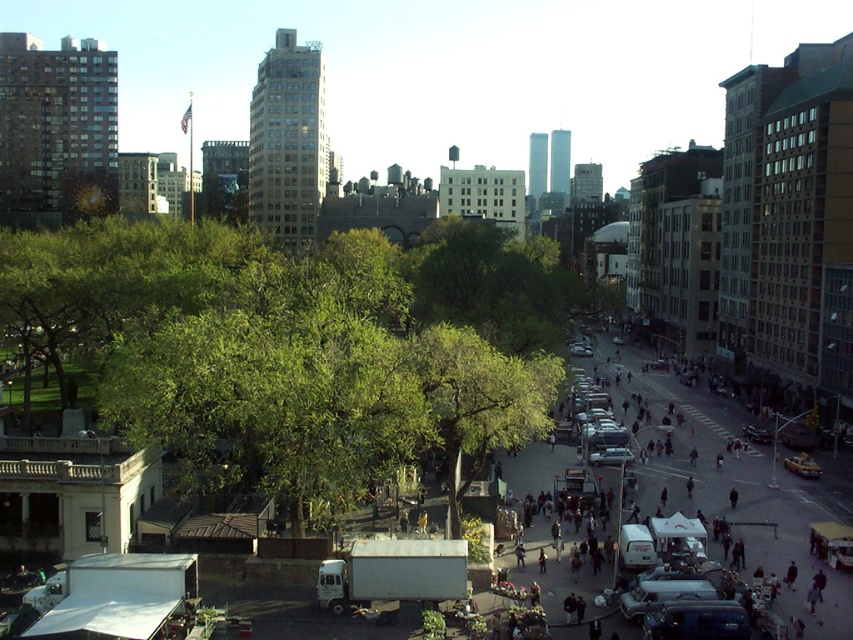
Question: Which object appears farthest from the camera in this image?

Choices:
 (A) green leafy tree at center
 (B) green leafy tree at center-left

Answer: (A)

Question: Which of the following is the farthest from the observer?

Choices:
 (A) (538, 401)
 (B) (421, 381)

Answer: (A)

Question: Is green leafy tree at center-left to the left of green leafy tree at center from the viewer's perspective?

Choices:
 (A) yes
 (B) no

Answer: (A)

Question: Is green leafy tree at center-left to the left of green leafy tree at center from the viewer's perspective?

Choices:
 (A) no
 (B) yes

Answer: (B)

Question: In this image, where is green leafy tree at center-left located relative to green leafy tree at center?

Choices:
 (A) above
 (B) below

Answer: (A)